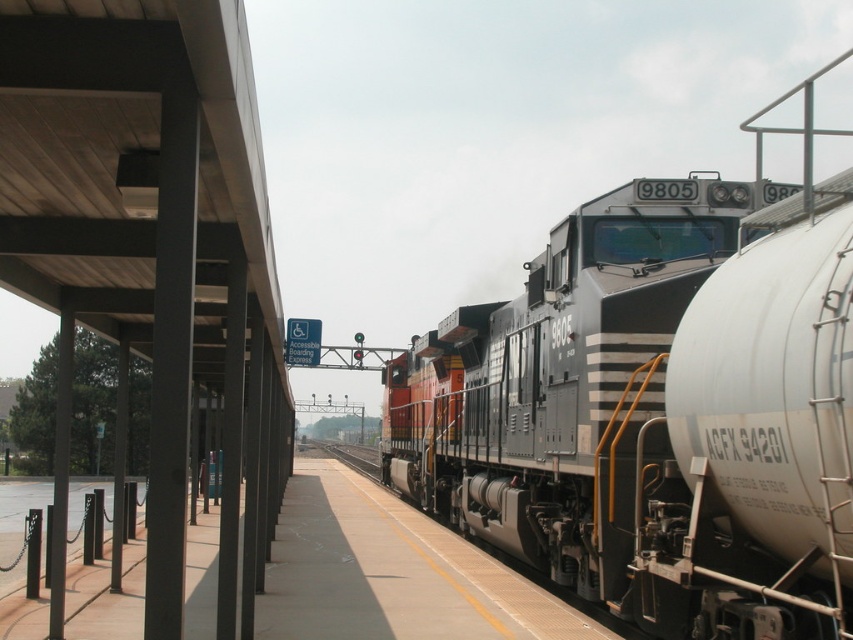
Question: Among these points, which one is nearest to the camera?

Choices:
 (A) (547, 604)
 (B) (350, 448)
 (C) (654, 337)

Answer: (C)

Question: Is black metal train at center above black metal train track at center?

Choices:
 (A) yes
 (B) no

Answer: (A)

Question: Which point is closer to the camera?

Choices:
 (A) (837, 209)
 (B) (91, 596)
 (C) (363, 449)

Answer: (A)

Question: Can you confirm if black metal train at center is thinner than black metal train track at center?

Choices:
 (A) yes
 (B) no

Answer: (B)

Question: Which is nearer to the concrete platform at center?

Choices:
 (A) black metal train track at center
 (B) black metal train at center

Answer: (B)

Question: Is the position of concrete platform at center more distant than that of black metal train track at center?

Choices:
 (A) yes
 (B) no

Answer: (B)